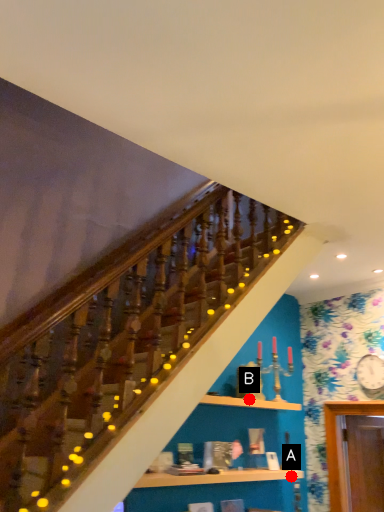
Question: Two points are circled on the image, labeled by A and B beside each circle. Which point is closer to the camera taking this photo?

Choices:
 (A) A is closer
 (B) B is closer

Answer: (B)